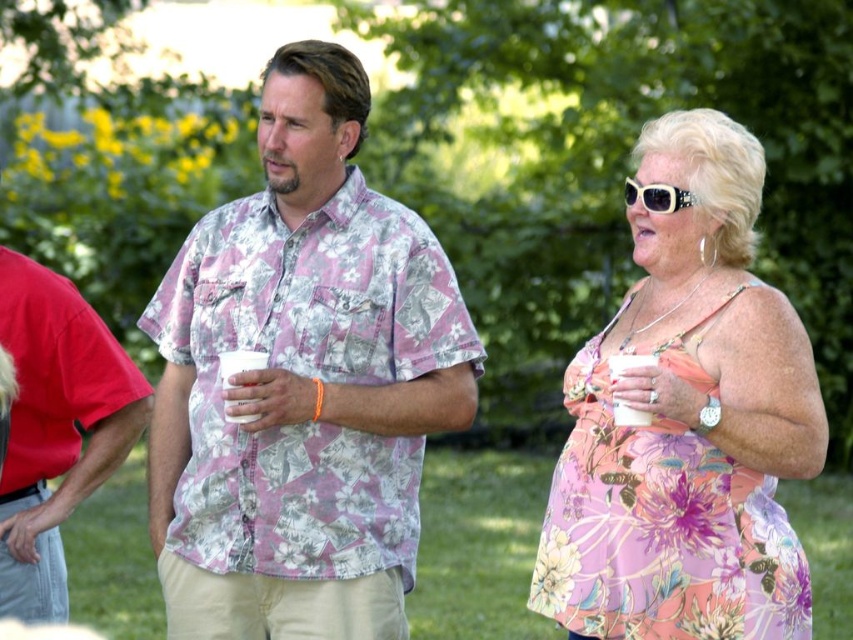
Is floral-patterned shirt at center below floral fabric dress at center?

No, floral-patterned shirt at center is not below floral fabric dress at center.

Which is behind, point (260, 552) or point (630, 300)?

Point (630, 300)

Where is `floral-patterned shirt at center`? This screenshot has width=853, height=640. floral-patterned shirt at center is located at coordinates (302, 381).

Is gold textured sunglasses at upper right bigger than white paper cup at center?

No.

The width and height of the screenshot is (853, 640). Find the location of `gold textured sunglasses at upper right`. gold textured sunglasses at upper right is located at coordinates (656, 196).

The height and width of the screenshot is (640, 853). In order to click on gold textured sunglasses at upper right in this screenshot , I will do `click(656, 196)`.

Between point (274, 620) and point (219, 360), which one is positioned behind?

The point (274, 620) is more distant.

Is floral-patterned shirt at center below white paper cup at center?

No.

Does point (170, 296) come closer to viewer compared to point (229, 360)?

No, it is not.

The width and height of the screenshot is (853, 640). I want to click on floral-patterned shirt at center, so click(302, 381).